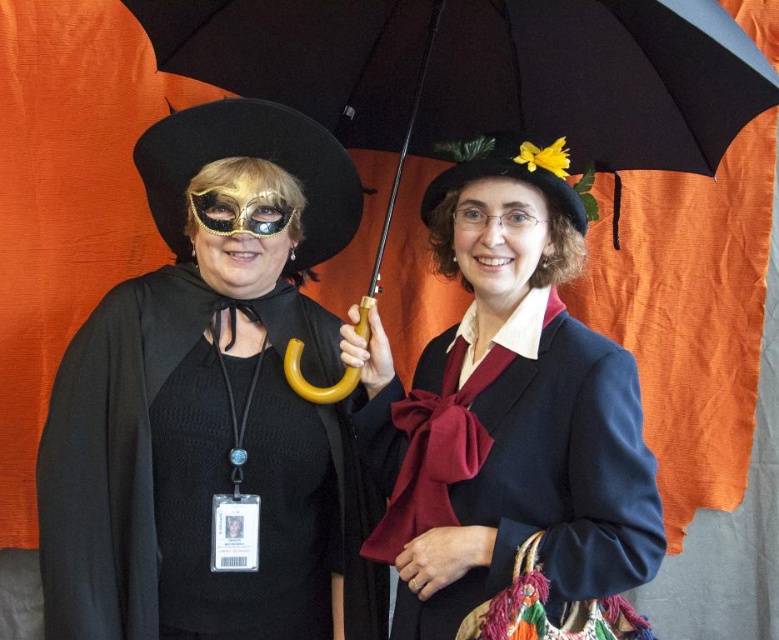
Can you confirm if matte blue coat at center is positioned to the left of black matte cape at left?

No, matte blue coat at center is not to the left of black matte cape at left.

Between matte blue coat at center and black matte cape at left, which one is positioned higher?

matte blue coat at center is above.

This screenshot has width=779, height=640. What do you see at coordinates (506, 410) in the screenshot?
I see `matte blue coat at center` at bounding box center [506, 410].

You are a GUI agent. You are given a task and a screenshot of the screen. Output one action in this format:
    pyautogui.click(x=<x>, y=<y>)
    Task: Click on the matte blue coat at center
    This screenshot has width=779, height=640.
    Given the screenshot: What is the action you would take?
    pyautogui.click(x=506, y=410)

Can you confirm if matte blue coat at center is positioned above black matte umbrella at center?

Actually, matte blue coat at center is below black matte umbrella at center.

Does point (346, 353) come behind point (506, 49)?

No, (346, 353) is closer to viewer.

Which is in front, point (439, 460) or point (728, 72)?

Point (439, 460) is more forward.

You are a GUI agent. You are given a task and a screenshot of the screen. Output one action in this format:
    pyautogui.click(x=<x>, y=<y>)
    Task: Click on the matte blue coat at center
    
    Given the screenshot: What is the action you would take?
    pyautogui.click(x=506, y=410)

Does matte black coat at center appear over black matte cape at left?

Yes, matte black coat at center is above black matte cape at left.

Is matte black coat at center shorter than black matte cape at left?

No.

Between point (104, 593) and point (321, 442), which one is positioned behind?

Positioned behind is point (321, 442).

At what (x,y) coordinates should I click in order to perform the action: click on matte black coat at center. Please return your answer as a coordinate pair (x, y). The image size is (779, 640). Looking at the image, I should click on (339, 417).